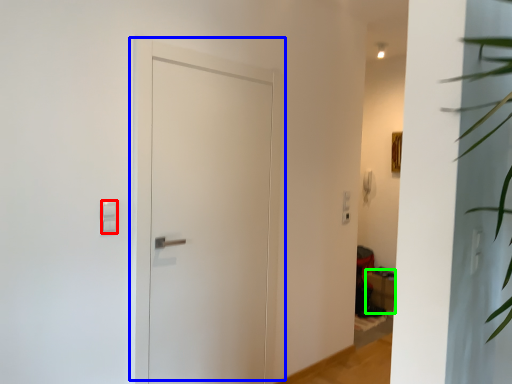
Question: Which object is positioned farthest from light switch (highlighted by a red box)? Select from door (highlighted by a blue box) and furniture (highlighted by a green box).

Choices:
 (A) door
 (B) furniture

Answer: (B)